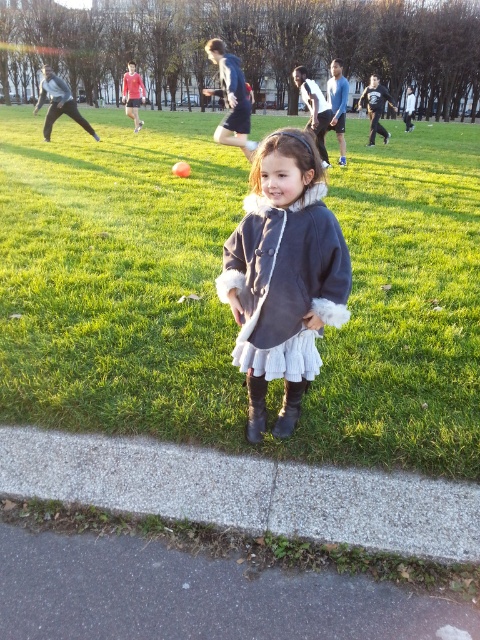
Question: Is black suede boot at lower center to the left of brown suede boot at lower center from the viewer's perspective?

Choices:
 (A) yes
 (B) no

Answer: (A)

Question: Does velvet gray coat at center have a greater width compared to brown suede boot at lower center?

Choices:
 (A) yes
 (B) no

Answer: (A)

Question: Which point is farther to the camera?

Choices:
 (A) (290, 392)
 (B) (264, 403)
 (C) (148, 115)

Answer: (C)

Question: Among these points, which one is nearest to the camera?

Choices:
 (A) (214, 218)
 (B) (288, 390)
 (C) (255, 428)

Answer: (C)

Question: Is velvet gray coat at center thinner than black suede boot at lower center?

Choices:
 (A) yes
 (B) no

Answer: (B)

Question: Which object is positioned farthest from the black suede boot at lower center?

Choices:
 (A) matte gray coat at center
 (B) velvet gray coat at center
 (C) brown suede boot at lower center

Answer: (A)